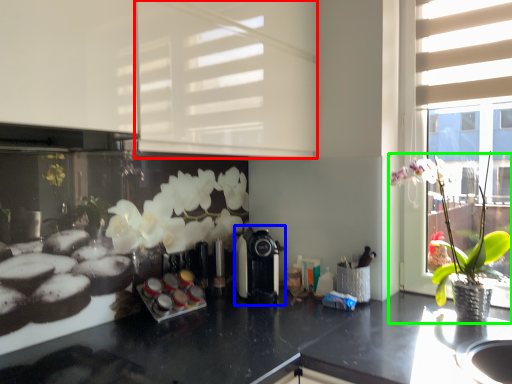
Question: Based on their relative distances, which object is nearer to shutter (highlighted by a red box)? Choose from coffee machine (highlighted by a blue box) and houseplant (highlighted by a green box).

Choices:
 (A) coffee machine
 (B) houseplant

Answer: (A)